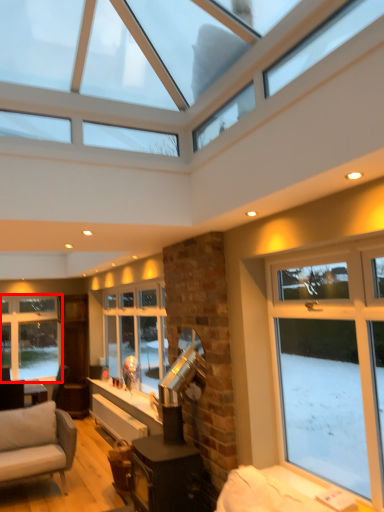
Question: From the image's perspective, where is window (annotated by the red box) located relative to window?

Choices:
 (A) below
 (B) above

Answer: (A)